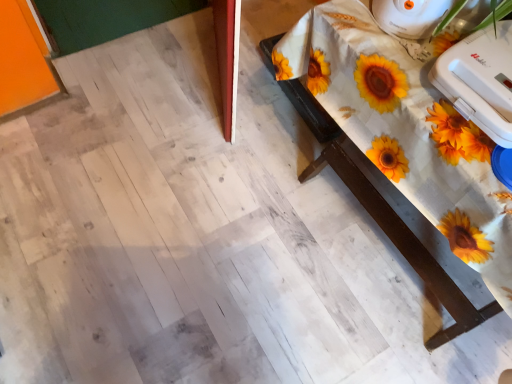
Locate an element on the screen. white plastic iron at upper right, positioned as the second appliance in bottom-to-top order is located at coordinates (409, 16).

Find the location of `white plastic iron at upper right, the 1th appliance positioned from the top`. white plastic iron at upper right, the 1th appliance positioned from the top is located at coordinates (409, 16).

The image size is (512, 384). What are the coordinates of `table that is on the right side of white plastic iron at upper right, positioned as the second appliance in bottom-to-top order` in the screenshot? It's located at (399, 151).

How different are the orientations of white plastic iron at upper right, positioned as the second appliance in bottom-to-top order, and white wood table at upper right in degrees?

The angle between the facing direction of white plastic iron at upper right, positioned as the second appliance in bottom-to-top order, and the facing direction of white wood table at upper right is 0.00672 degrees.

Could you measure the distance between white plastic iron at upper right, positioned as the second appliance in bottom-to-top order, and white wood table at upper right?

The distance of white plastic iron at upper right, positioned as the second appliance in bottom-to-top order, from white wood table at upper right is 14.84 inches.

Considering the sizes of objects white plastic iron at upper right, the 1th appliance positioned from the top, and white wood table at upper right in the image provided, who is bigger, white plastic iron at upper right, the 1th appliance positioned from the top, or white wood table at upper right?

white wood table at upper right.

Is white wood table at upper right not within white plastic iron at upper right, positioned as the second appliance in bottom-to-top order?

white wood table at upper right lies outside white plastic iron at upper right, positioned as the second appliance in bottom-to-top order,'s area.

Which of these two, white wood table at upper right or white plastic iron at upper right, the 1th appliance positioned from the top, is thinner?

Thinner between the two is white plastic iron at upper right, the 1th appliance positioned from the top.

Is point (340, 134) less distant than point (380, 27)?

No, (340, 134) is behind (380, 27).

Is white plastic toaster at upper right, which is the second appliance from top to bottom, inside white plastic iron at upper right, the 1th appliance positioned from the top?

A: No, white plastic toaster at upper right, which is the second appliance from top to bottom, is located outside of white plastic iron at upper right, the 1th appliance positioned from the top.

Is white plastic iron at upper right, the 1th appliance positioned from the top, beside white plastic toaster at upper right, which is the second appliance from top to bottom?

No, white plastic iron at upper right, the 1th appliance positioned from the top, is not next to white plastic toaster at upper right, which is the second appliance from top to bottom.

Does white plastic iron at upper right, the 1th appliance positioned from the top, appear on the left side of white plastic toaster at upper right, arranged as the 1th appliance when ordered from the bottom?

Yes, white plastic iron at upper right, the 1th appliance positioned from the top, is to the left of white plastic toaster at upper right, arranged as the 1th appliance when ordered from the bottom.

Is white plastic toaster at upper right, which is the second appliance from top to bottom, oriented towards white wood table at upper right?

No, white plastic toaster at upper right, which is the second appliance from top to bottom, does not turn towards white wood table at upper right.

Considering the sizes of objects white plastic toaster at upper right, which is the second appliance from top to bottom, and white wood table at upper right in the image provided, who is taller, white plastic toaster at upper right, which is the second appliance from top to bottom, or white wood table at upper right?

Standing taller between the two is white wood table at upper right.

From a real-world perspective, does white plastic toaster at upper right, which is the second appliance from top to bottom, sit lower than white wood table at upper right?

No.

From the image's perspective, between white plastic toaster at upper right, arranged as the 1th appliance when ordered from the bottom, and white plastic iron at upper right, the 1th appliance positioned from the top, who is located below?

From the image's view, white plastic toaster at upper right, arranged as the 1th appliance when ordered from the bottom, is below.

Is white plastic toaster at upper right, arranged as the 1th appliance when ordered from the bottom, looking in the opposite direction of white plastic iron at upper right, the 1th appliance positioned from the top?

No, white plastic toaster at upper right, arranged as the 1th appliance when ordered from the bottom,'s orientation is not away from white plastic iron at upper right, the 1th appliance positioned from the top.

What's the angular difference between white plastic toaster at upper right, which is the second appliance from top to bottom, and white plastic iron at upper right, the 1th appliance positioned from the top,'s facing directions?

The angle between the facing direction of white plastic toaster at upper right, which is the second appliance from top to bottom, and the facing direction of white plastic iron at upper right, the 1th appliance positioned from the top, is 3.85 degrees.

Is white plastic toaster at upper right, arranged as the 1th appliance when ordered from the bottom, next to white plastic iron at upper right, positioned as the second appliance in bottom-to-top order, and touching it?

No, white plastic toaster at upper right, arranged as the 1th appliance when ordered from the bottom, is not beside white plastic iron at upper right, positioned as the second appliance in bottom-to-top order.

Which is in front, white wood table at upper right or white plastic toaster at upper right, arranged as the 1th appliance when ordered from the bottom?

white wood table at upper right is in front.

Does white wood table at upper right have a greater height compared to white plastic toaster at upper right, arranged as the 1th appliance when ordered from the bottom?

Yes, white wood table at upper right is taller than white plastic toaster at upper right, arranged as the 1th appliance when ordered from the bottom.

You are a GUI agent. You are given a task and a screenshot of the screen. Output one action in this format:
    pyautogui.click(x=<x>, y=<y>)
    Task: Click on the table that is below the white plastic toaster at upper right, which is the second appliance from top to bottom (from the image's perspective)
    
    Given the screenshot: What is the action you would take?
    pyautogui.click(x=399, y=151)

Is white plastic toaster at upper right, which is the second appliance from top to bottom, a part of white wood table at upper right?

No, white plastic toaster at upper right, which is the second appliance from top to bottom, is located outside of white wood table at upper right.

Identify the location of appliance that is the 2nd one above the white wood table at upper right (from a real-world perspective). (409, 16).

This screenshot has height=384, width=512. Identify the location of table that is under the white plastic iron at upper right, positioned as the second appliance in bottom-to-top order (from a real-world perspective). (399, 151).

Estimate the real-world distances between objects in this image. Which object is further from white plastic iron at upper right, the 1th appliance positioned from the top, white wood table at upper right or white plastic toaster at upper right, arranged as the 1th appliance when ordered from the bottom?

white wood table at upper right is further to white plastic iron at upper right, the 1th appliance positioned from the top.

Looking at the image, which one is located closer to white wood table at upper right, white plastic toaster at upper right, arranged as the 1th appliance when ordered from the bottom, or white plastic iron at upper right, positioned as the second appliance in bottom-to-top order?

white plastic toaster at upper right, arranged as the 1th appliance when ordered from the bottom, is closer to white wood table at upper right.

Based on the photo, from the image, which object appears to be nearer to white wood table at upper right, white plastic iron at upper right, the 1th appliance positioned from the top, or white plastic toaster at upper right, arranged as the 1th appliance when ordered from the bottom?

white plastic toaster at upper right, arranged as the 1th appliance when ordered from the bottom.

Considering their positions, is white wood table at upper right positioned further to white plastic toaster at upper right, which is the second appliance from top to bottom, than white plastic iron at upper right, positioned as the second appliance in bottom-to-top order?

The object further to white plastic toaster at upper right, which is the second appliance from top to bottom, is white wood table at upper right.

From the image, which object appears to be farther from white plastic iron at upper right, positioned as the second appliance in bottom-to-top order, white plastic toaster at upper right, arranged as the 1th appliance when ordered from the bottom, or white wood table at upper right?

white wood table at upper right.

Based on their spatial positions, is white plastic iron at upper right, positioned as the second appliance in bottom-to-top order, or white wood table at upper right closer to white plastic toaster at upper right, which is the second appliance from top to bottom?

white plastic iron at upper right, positioned as the second appliance in bottom-to-top order.

Locate an element on the screen. Image resolution: width=512 pixels, height=384 pixels. appliance that lies between white plastic iron at upper right, the 1th appliance positioned from the top, and white wood table at upper right from top to bottom is located at coordinates (480, 80).